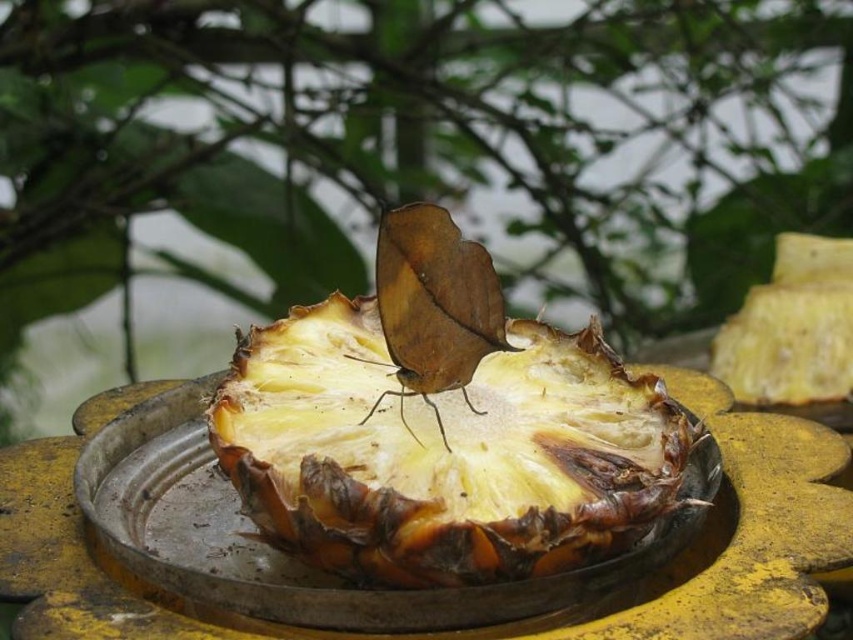
You are a bee trying to land on the yellow matte pineapple at center. There is a brown matte butterfly at center already there. Can you fit on the pineapple without overlapping the butterfly?

The yellow matte pineapple at center is wider than the brown matte butterfly at center, so yes, the bee can land on the pineapple without overlapping the butterfly since there is enough space.

You are a photographer trying to capture a clear shot of both the yellow matte pineapple at center and the brown matte butterfly at center. Since the background is blurred, which object should you focus on to ensure it appears sharp in the photo?

You should focus on the yellow matte pineapple at center because it is closer to the viewer than the brown matte butterfly at center, so focusing on it will keep it sharp while the butterfly may be slightly out of focus due to the shallow depth of field.

You are a photographer trying to capture the yellow matte pineapple at center. According to the coordinates provided, where should you focus your camera lens to ensure the pineapple is in sharp focus?

You should focus your camera lens at point (445, 452) to ensure the yellow matte pineapple at center is in sharp focus.